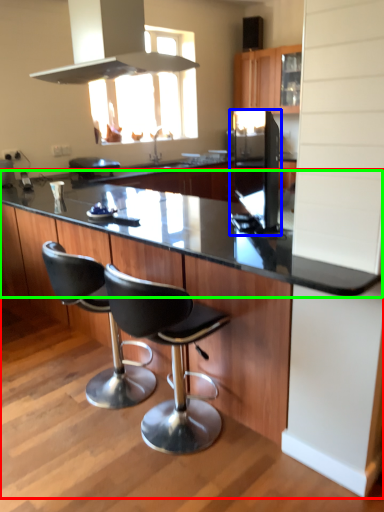
Question: Which object is the closest to the countertop (highlighted by a red box)? Choose among these: appliance (highlighted by a blue box) or countertop (highlighted by a green box).

Choices:
 (A) appliance
 (B) countertop

Answer: (B)